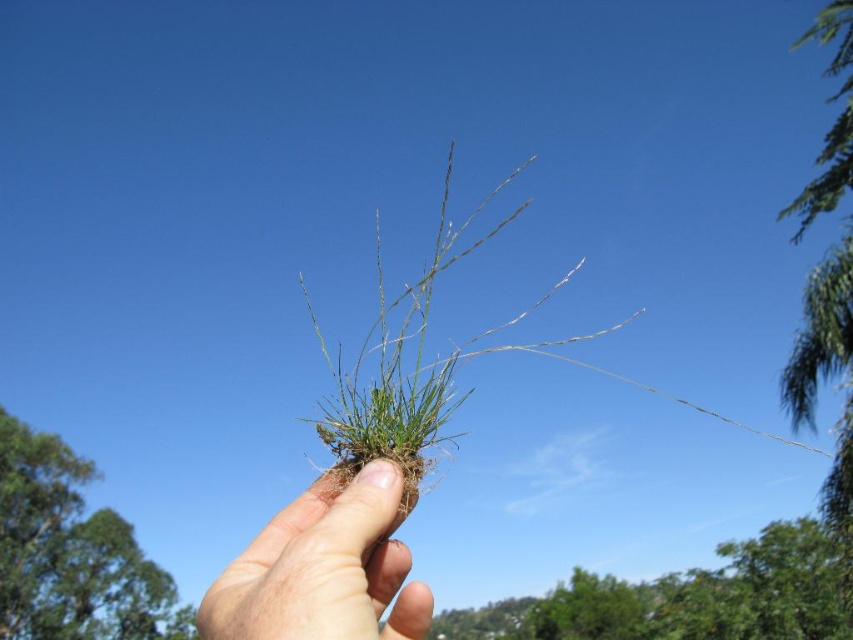
Can you confirm if green leafy tree at lower right is positioned below flesh-toned skin at center?

Yes.

Based on the photo, which is more to the right, green leafy tree at lower right or flesh-toned skin at center?

green leafy tree at lower right is more to the right.

Locate an element on the screen. The image size is (853, 640). green leafy tree at lower right is located at coordinates (688, 598).

Does green leafy tree at lower right have a smaller size compared to green leafy tree at upper left?

Incorrect, green leafy tree at lower right is not smaller in size than green leafy tree at upper left.

Identify the location of green leafy tree at lower right. (688, 598).

What do you see at coordinates (323, 568) in the screenshot? Image resolution: width=853 pixels, height=640 pixels. I see `flesh-toned skin at center` at bounding box center [323, 568].

Between flesh-toned skin at center and green leafy tree at upper left, which one is positioned higher?

Positioned higher is flesh-toned skin at center.

Between point (328, 580) and point (22, 445), which one is positioned behind?

The point (22, 445) is behind.

Where is `flesh-toned skin at center`? The height and width of the screenshot is (640, 853). flesh-toned skin at center is located at coordinates (323, 568).